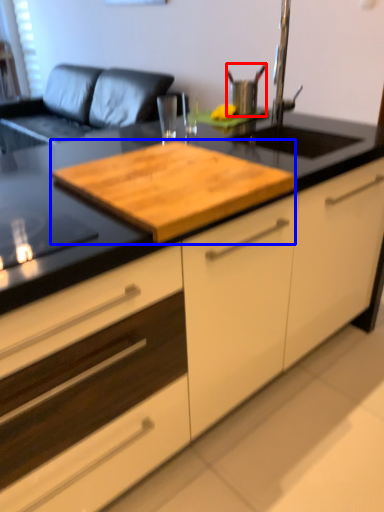
Question: Which object is further to the camera taking this photo, appliance (highlighted by a red box) or wood (highlighted by a blue box)?

Choices:
 (A) appliance
 (B) wood

Answer: (A)